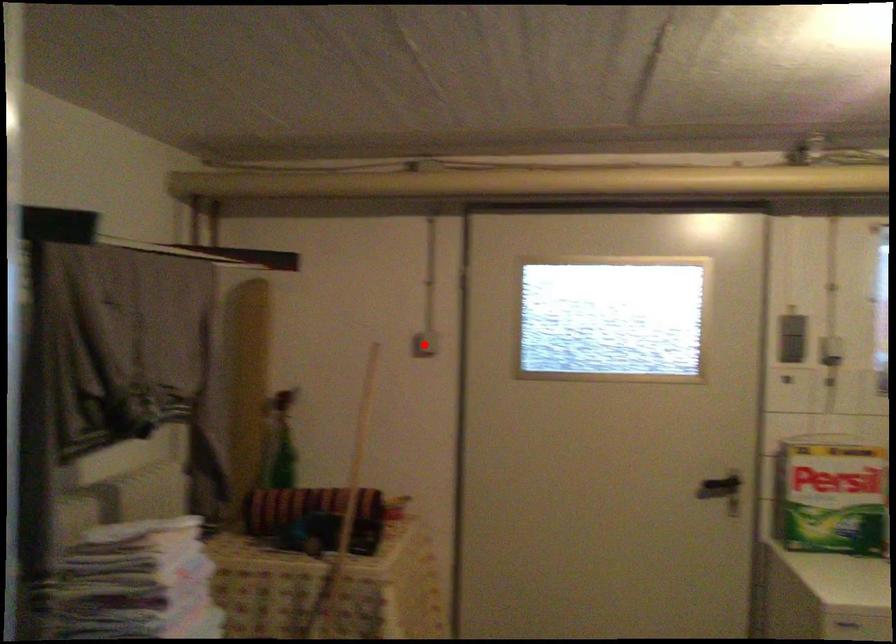
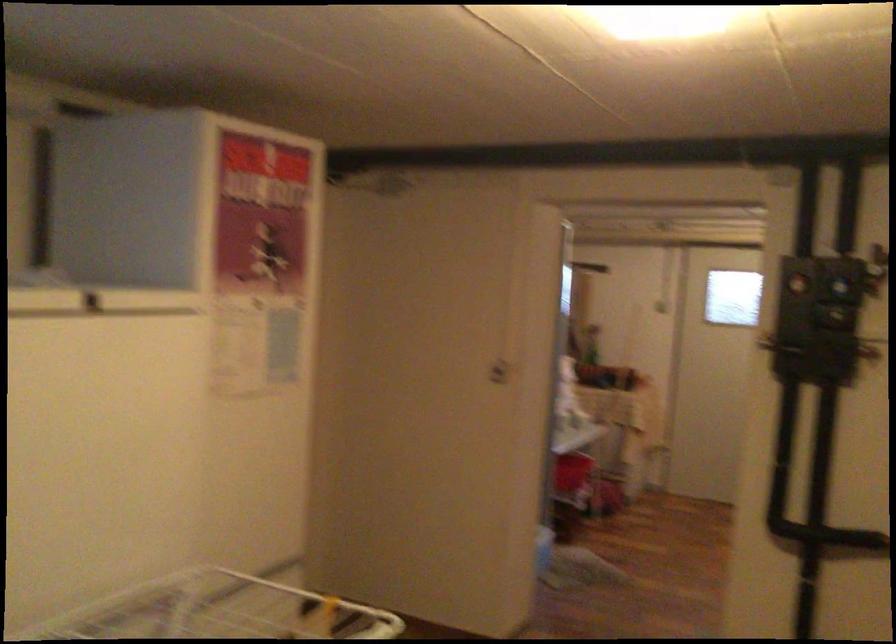
Question: I am providing you with two images of the same scene from different viewpoints. A red point is marked on the first image. Can you still see the location of the red point in image 2?

Choices:
 (A) Yes
 (B) No

Answer: (B)